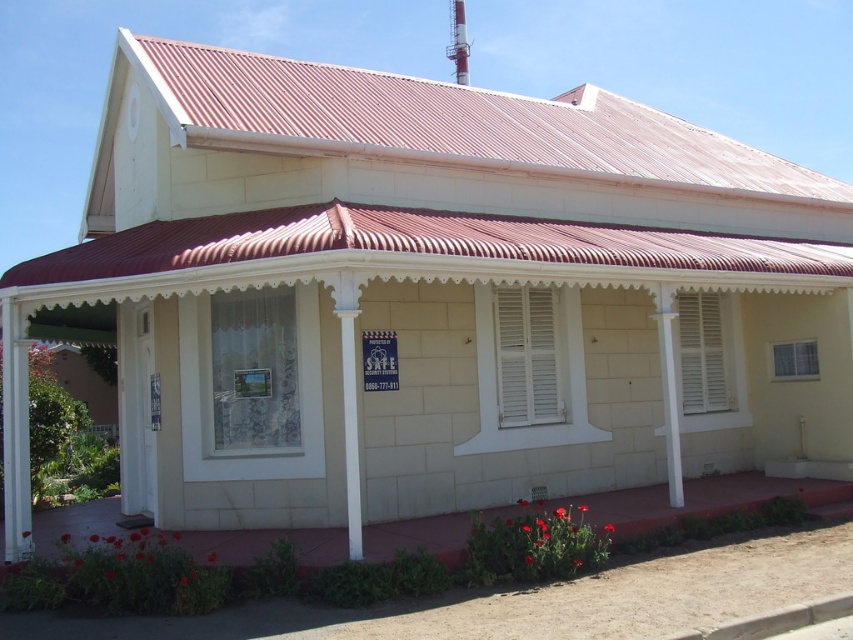
Question: Does white matte shutter at center appear on the left side of white wooden shutters at center?

Choices:
 (A) no
 (B) yes

Answer: (B)

Question: Which point is farther from the camera taking this photo?

Choices:
 (A) (698, 337)
 (B) (514, 326)
 (C) (341, 540)

Answer: (A)

Question: Is red concrete porch at lower center to the left of white wooden shutters at center from the viewer's perspective?

Choices:
 (A) no
 (B) yes

Answer: (B)

Question: Is red concrete porch at lower center bigger than white matte shutter at center?

Choices:
 (A) no
 (B) yes

Answer: (B)

Question: Which object is positioned farthest from the red concrete porch at lower center?

Choices:
 (A) white wooden shutters at center
 (B) white matte shutter at center

Answer: (A)

Question: Estimate the real-world distances between objects in this image. Which object is closer to the red concrete porch at lower center?

Choices:
 (A) white matte shutter at center
 (B) white wooden shutters at center

Answer: (A)